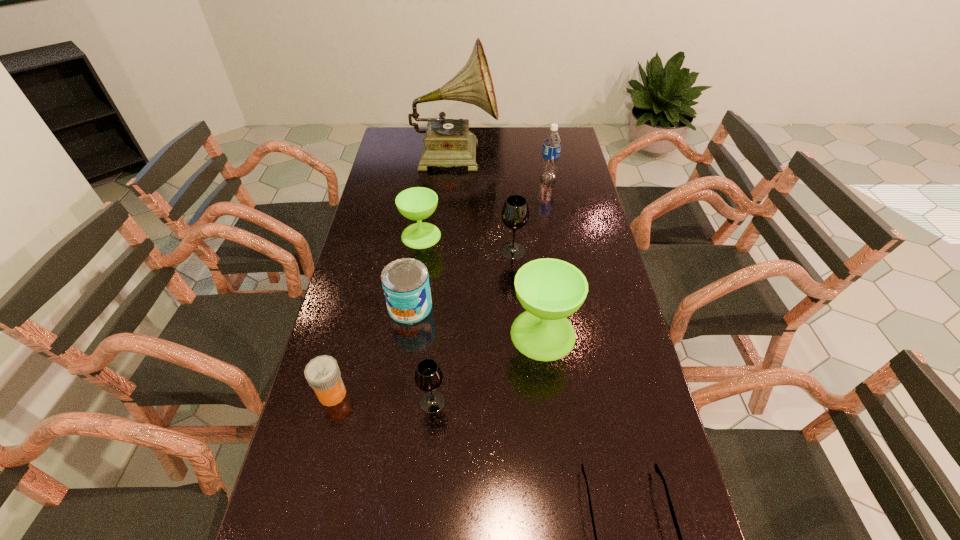
The height and width of the screenshot is (540, 960). What are the coordinates of `the nearer gray wineglass` in the screenshot? It's located at (428, 376).

In order to click on blue can in this screenshot , I will do tap(405, 282).

I want to click on orange medicine, so click(322, 373).

Locate an element on the screen. The width and height of the screenshot is (960, 540). the second shortest object is located at coordinates (322, 373).

The width and height of the screenshot is (960, 540). In order to click on free space located from the horn of the tallest object in this screenshot , I will do `click(540, 154)`.

Where is `vacant space located 0.070m on the left of the second farthest object`? The width and height of the screenshot is (960, 540). vacant space located 0.070m on the left of the second farthest object is located at coordinates (522, 178).

You are a GUI agent. You are given a task and a screenshot of the screen. Output one action in this format:
    pyautogui.click(x=<x>, y=<y>)
    Task: Click on the vacant area located 0.190m on the right of the right gray wineglass
    The image size is (960, 540).
    Given the screenshot: What is the action you would take?
    pyautogui.click(x=583, y=251)

You are a GUI agent. You are given a task and a screenshot of the screen. Output one action in this format:
    pyautogui.click(x=<x>, y=<y>)
    Task: Click on the vacant area located 0.250m on the back of the nearer green wineglass
    The height and width of the screenshot is (540, 960).
    Given the screenshot: What is the action you would take?
    pyautogui.click(x=533, y=251)

Identify the location of vacant region located 0.070m on the back of the left green wineglass. (424, 211).

You are a GUI agent. You are given a task and a screenshot of the screen. Output one action in this format:
    pyautogui.click(x=<x>, y=<y>)
    Task: Click on the free location located on the back of the nearer gray wineglass
    
    Given the screenshot: What is the action you would take?
    pyautogui.click(x=443, y=283)